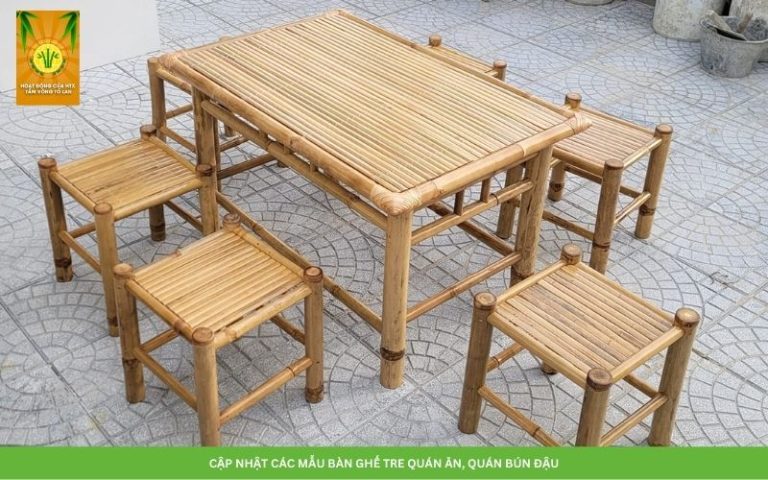
This screenshot has height=480, width=768. Find the location of `bucket`. bucket is located at coordinates (729, 55).